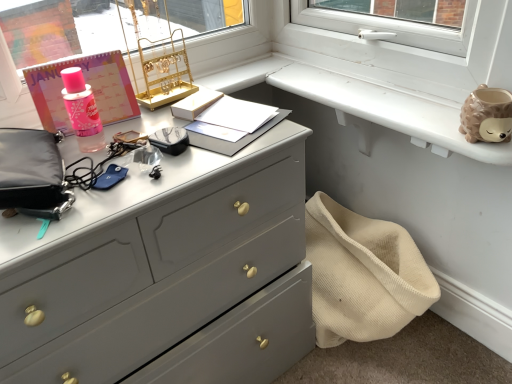
Question: Is matte black pouch at left at the back of matte gray dresser at center?

Choices:
 (A) yes
 (B) no

Answer: (B)

Question: From a real-world perspective, is matte gray dresser at center over matte black pouch at left?

Choices:
 (A) yes
 (B) no

Answer: (B)

Question: From the image's perspective, is matte gray dresser at center above matte black pouch at left?

Choices:
 (A) no
 (B) yes

Answer: (A)

Question: Is matte gray dresser at center next to matte black pouch at left and touching it?

Choices:
 (A) yes
 (B) no

Answer: (B)

Question: From a real-world perspective, is matte gray dresser at center located beneath matte black pouch at left?

Choices:
 (A) yes
 (B) no

Answer: (A)

Question: Can you confirm if matte gray dresser at center is smaller than matte black pouch at left?

Choices:
 (A) yes
 (B) no

Answer: (B)

Question: Is white matte window sill at upper right aimed at gold metallic jewelry stand at upper center?

Choices:
 (A) no
 (B) yes

Answer: (A)

Question: Is white matte window sill at upper right turned away from gold metallic jewelry stand at upper center?

Choices:
 (A) yes
 (B) no

Answer: (B)

Question: Is white matte window sill at upper right further to camera compared to gold metallic jewelry stand at upper center?

Choices:
 (A) yes
 (B) no

Answer: (B)

Question: Is white matte window sill at upper right taller than gold metallic jewelry stand at upper center?

Choices:
 (A) yes
 (B) no

Answer: (B)

Question: Can you confirm if white matte window sill at upper right is shorter than gold metallic jewelry stand at upper center?

Choices:
 (A) no
 (B) yes

Answer: (B)

Question: From a real-world perspective, is white matte window sill at upper right beneath gold metallic jewelry stand at upper center?

Choices:
 (A) yes
 (B) no

Answer: (A)

Question: Does white matte window sill at upper right have a larger size compared to matte gray dresser at center?

Choices:
 (A) yes
 (B) no

Answer: (B)